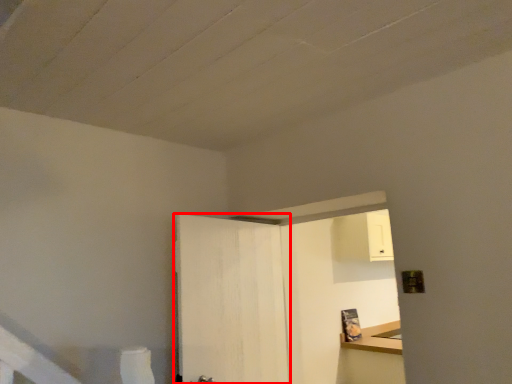
Question: From the image's perspective, what is the correct spatial relationship of door (annotated by the red box) in relation to dresser?

Choices:
 (A) below
 (B) above

Answer: (B)